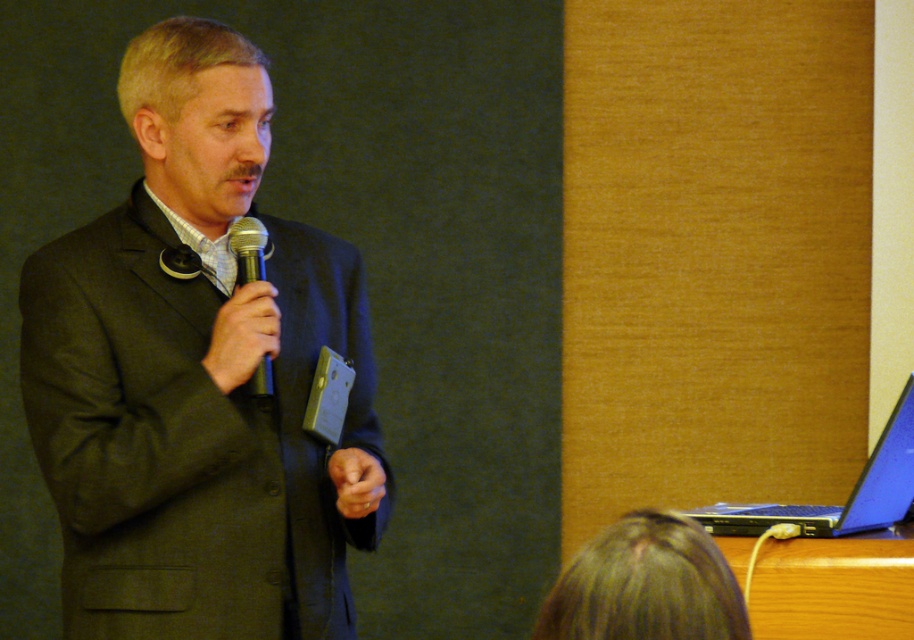
Can you confirm if dark gray suit at center is bigger than black matte microphone at center?

Yes.

What do you see at coordinates (198, 378) in the screenshot? I see `dark gray suit at center` at bounding box center [198, 378].

What are the coordinates of `dark gray suit at center` in the screenshot? It's located at (198, 378).

Describe the element at coordinates (198, 378) in the screenshot. This screenshot has height=640, width=914. I see `dark gray suit at center` at that location.

In the scene shown: Is dark gray suit at center to the left of blue glossy laptop at lower right from the viewer's perspective?

Yes, dark gray suit at center is to the left of blue glossy laptop at lower right.

Who is more forward, (321, 497) or (888, 445)?

Positioned in front is point (321, 497).

Locate an element on the screen. dark gray suit at center is located at coordinates (x=198, y=378).

Can you confirm if blue glossy laptop at lower right is thinner than black matte microphone at center?

No.

Is point (817, 532) closer to viewer compared to point (262, 260)?

No, (817, 532) is behind (262, 260).

Between point (902, 477) and point (258, 275), which one is positioned behind?

The point (902, 477) is behind.

Where is `blue glossy laptop at lower right`? The height and width of the screenshot is (640, 914). blue glossy laptop at lower right is located at coordinates (848, 497).